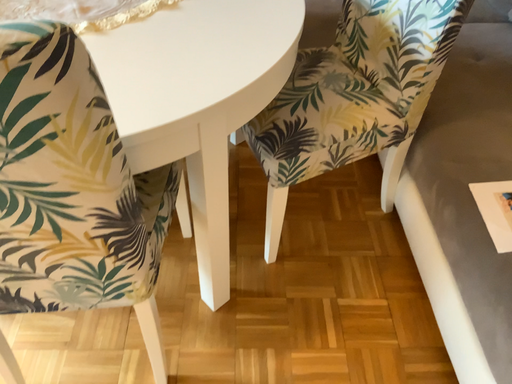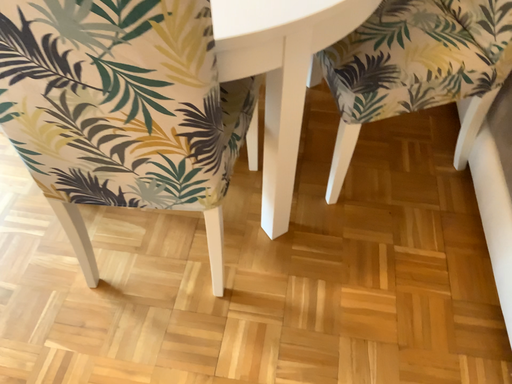
Question: Which way did the camera rotate in the video?

Choices:
 (A) rotated left
 (B) rotated right

Answer: (A)